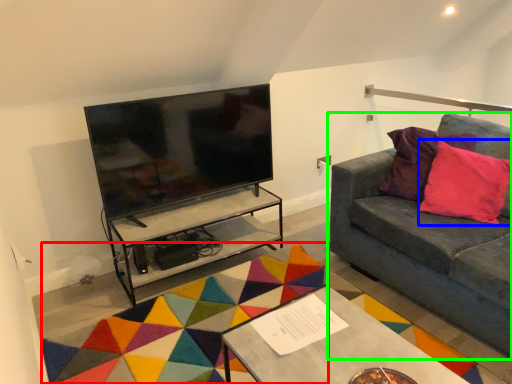
Question: Considering the real-world distances, which object is closest to mat (highlighted by a red box)? throw pillow (highlighted by a blue box) or studio couch (highlighted by a green box).

Choices:
 (A) throw pillow
 (B) studio couch

Answer: (B)